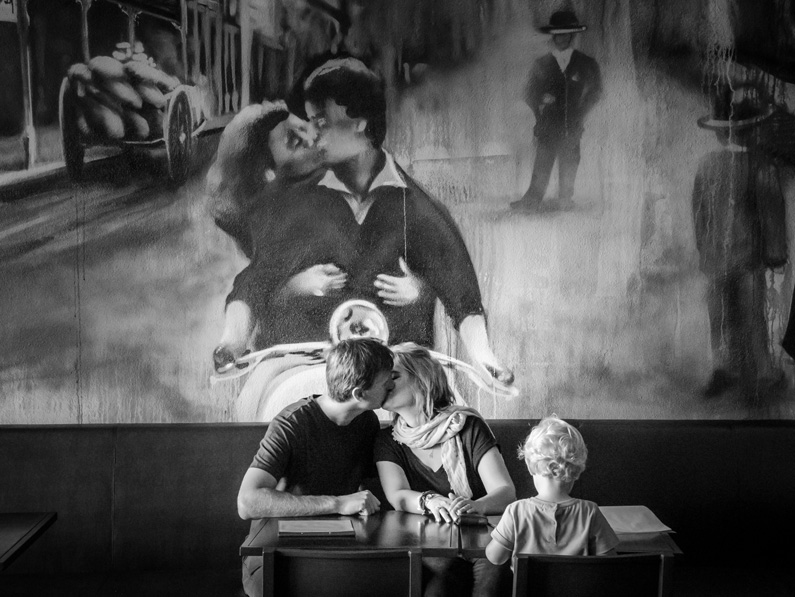
Locate an element on the screen. This screenshot has width=795, height=597. eatery table is located at coordinates (378, 536), (640, 544).